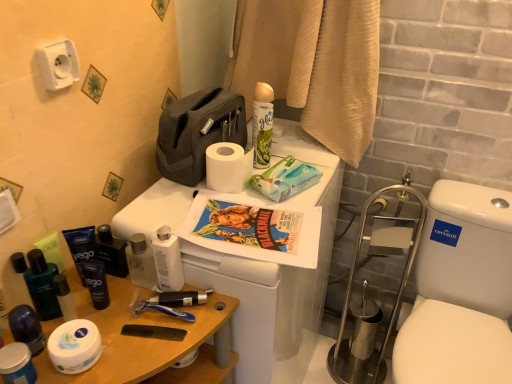
You are a GUI agent. You are given a task and a screenshot of the screen. Output one action in this format:
    pyautogui.click(x=<x>, y=<y>)
    Task: Click on the vacant area in front of matte black shaving cream at left, which is counted as the third toiletry, starting from the right
    
    Given the screenshot: What is the action you would take?
    tap(121, 322)